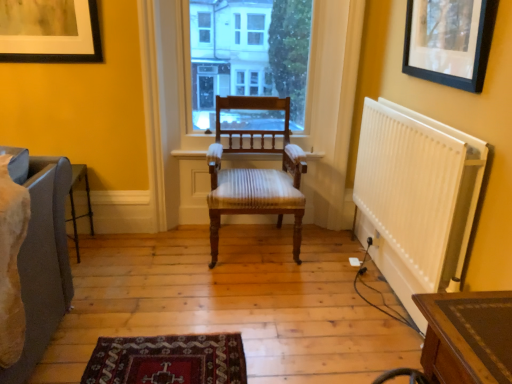
This screenshot has height=384, width=512. I want to click on free point below white plastic radiator at right (from a real-world perspective), so click(x=392, y=297).